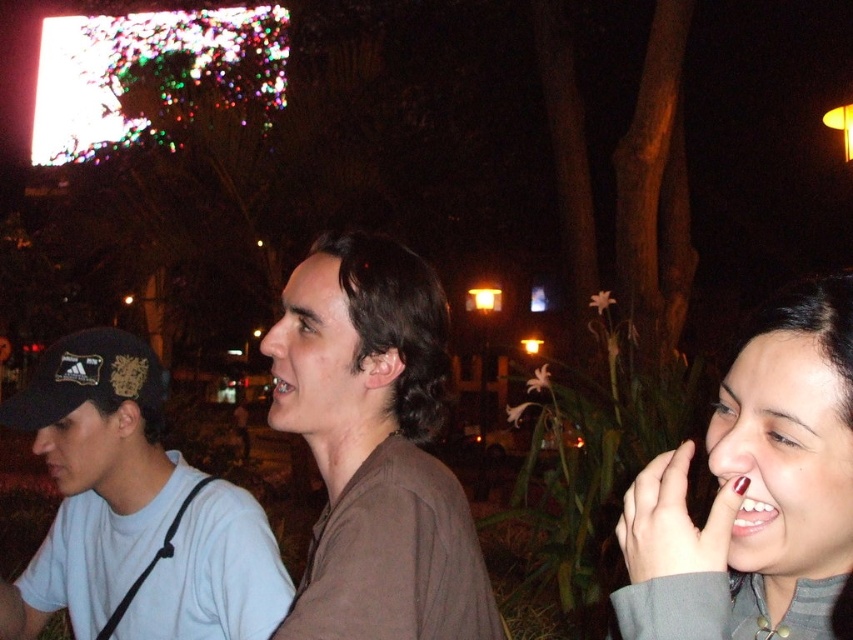
Question: Can you confirm if brown matte shirt at center is thinner than matte gray sweater at right?

Choices:
 (A) no
 (B) yes

Answer: (A)

Question: Based on their relative distances, which object is farther from the black fabric baseball cap at left?

Choices:
 (A) matte gray sweater at right
 (B) brown matte shirt at center
 (C) white matte shirt at left

Answer: (A)

Question: Does white matte shirt at left appear on the right side of black fabric baseball cap at left?

Choices:
 (A) no
 (B) yes

Answer: (B)

Question: Which point appears closest to the camera in this image?

Choices:
 (A) (300, 378)
 (B) (155, 381)

Answer: (A)

Question: Is white matte shirt at left smaller than black fabric baseball cap at left?

Choices:
 (A) yes
 (B) no

Answer: (B)

Question: Which object is farther from the camera taking this photo?

Choices:
 (A) brown matte shirt at center
 (B) black fabric baseball cap at left
 (C) white matte shirt at left
 (D) matte gray sweater at right

Answer: (B)